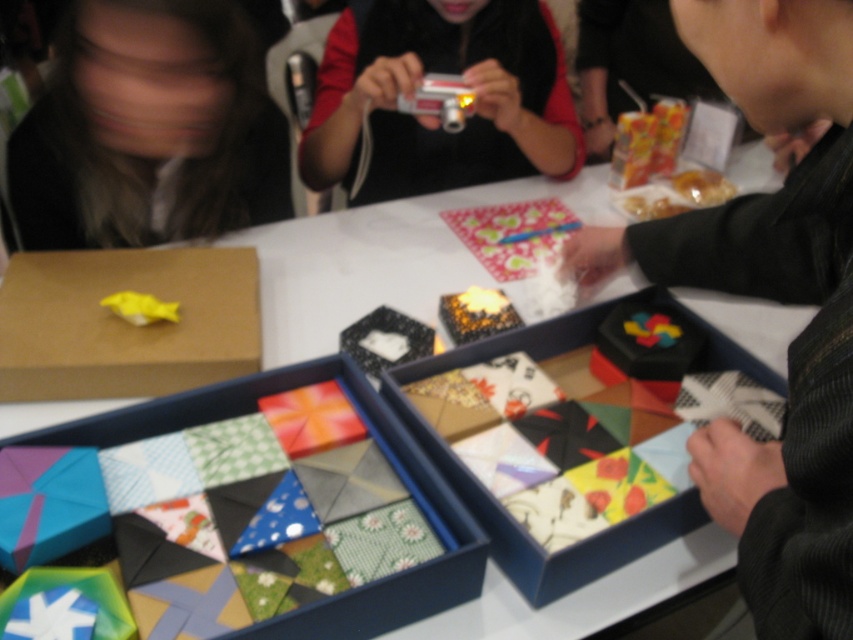
You are a photographer at an origami workshop. You need to adjust your camera to focus on the colorful paper box at center. Since the matte black camera at center is in the way, can you move the camera to the side to get a clear shot of the box?

The colorful paper box at center is located below the matte black camera at center. Therefore, moving the matte black camera at center to the side would allow you to see the colorful paper box at center clearly.

You are standing at the craft workshop and see two points marked on the floor. The first point is at coordinate point (827,163) and the second is at point (575,323). If you want to walk towards the point that is closer to you, which coordinate should you head towards?

Point (827,163) is in front of point (575,323), so you should head towards point (827,163) as it is closer to your current position.